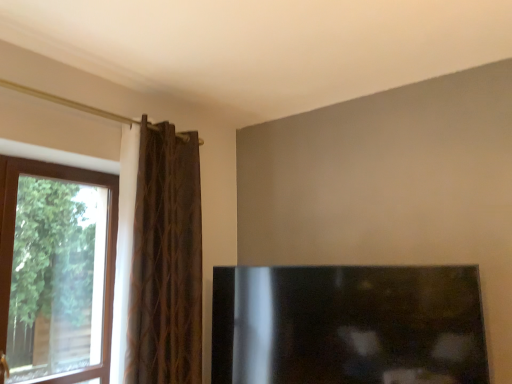
Question: Is brown textured curtain at left at the back of black glossy fireplace at lower right?

Choices:
 (A) yes
 (B) no

Answer: (B)

Question: From a real-world perspective, is black glossy fireplace at lower right under brown textured curtain at left?

Choices:
 (A) no
 (B) yes

Answer: (B)

Question: From the image's perspective, would you say black glossy fireplace at lower right is positioned over brown textured curtain at left?

Choices:
 (A) no
 (B) yes

Answer: (A)

Question: From the image's perspective, is black glossy fireplace at lower right under brown textured curtain at left?

Choices:
 (A) no
 (B) yes

Answer: (B)

Question: Is black glossy fireplace at lower right closer to the viewer compared to brown textured curtain at left?

Choices:
 (A) no
 (B) yes

Answer: (B)

Question: Considering the positions of transparent glass window at left and brown textured curtain at left in the image, is transparent glass window at left bigger or smaller than brown textured curtain at left?

Choices:
 (A) big
 (B) small

Answer: (B)

Question: Which is correct: transparent glass window at left is inside brown textured curtain at left, or outside of it?

Choices:
 (A) outside
 (B) inside

Answer: (A)

Question: In the image, is transparent glass window at left positioned in front of or behind brown textured curtain at left?

Choices:
 (A) behind
 (B) front

Answer: (B)

Question: Is point (10, 254) closer or farther from the camera than point (145, 327)?

Choices:
 (A) closer
 (B) farther

Answer: (B)

Question: Is brown textured curtain at left bigger or smaller than transparent glass window at left?

Choices:
 (A) big
 (B) small

Answer: (A)

Question: In terms of width, does brown textured curtain at left look wider or thinner when compared to transparent glass window at left?

Choices:
 (A) thin
 (B) wide

Answer: (B)

Question: Considering the positions of brown textured curtain at left and transparent glass window at left in the image, is brown textured curtain at left taller or shorter than transparent glass window at left?

Choices:
 (A) short
 (B) tall

Answer: (B)

Question: Visually, is brown textured curtain at left positioned to the left or to the right of transparent glass window at left?

Choices:
 (A) right
 (B) left

Answer: (A)

Question: Looking at the image, does black glossy fireplace at lower right seem bigger or smaller compared to brown textured curtain at left?

Choices:
 (A) big
 (B) small

Answer: (B)

Question: Is black glossy fireplace at lower right taller or shorter than brown textured curtain at left?

Choices:
 (A) tall
 (B) short

Answer: (B)